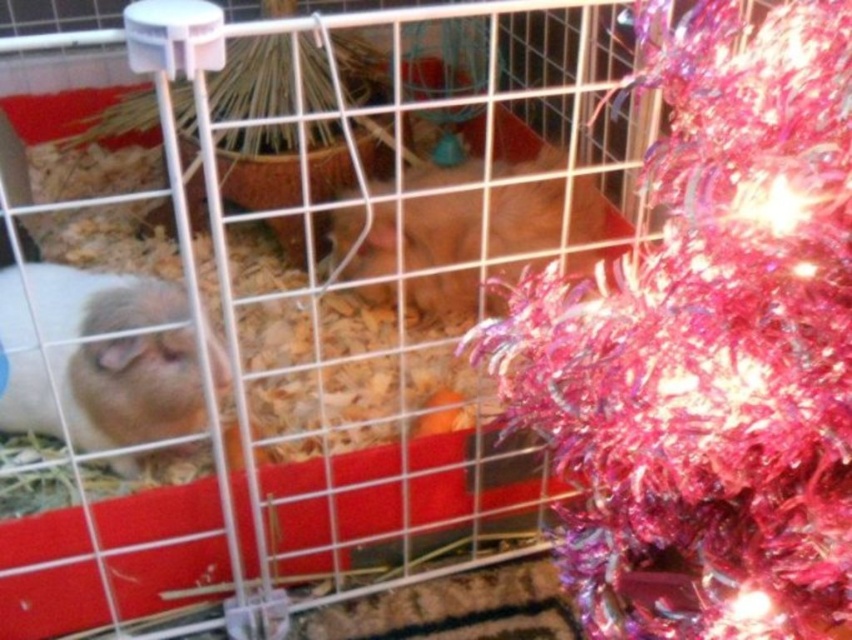
You are a guinea pig in the cage and want to reach the food dish. You are currently at point (x=663, y=556). Which direction should you move to reach the food dish located at point (x=471, y=272)?

To reach the food dish located at point (x=471, y=272) from your current position at point (x=663, y=556), you should move backward since point (x=663, y=556) is in front of point (x=471, y=272).